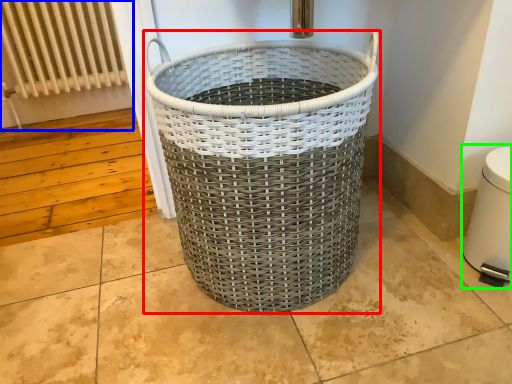
Question: Considering the real-world distances, which object is closest to waste container (highlighted by a red box)? radiator (highlighted by a blue box) or water heater (highlighted by a green box).

Choices:
 (A) radiator
 (B) water heater

Answer: (B)